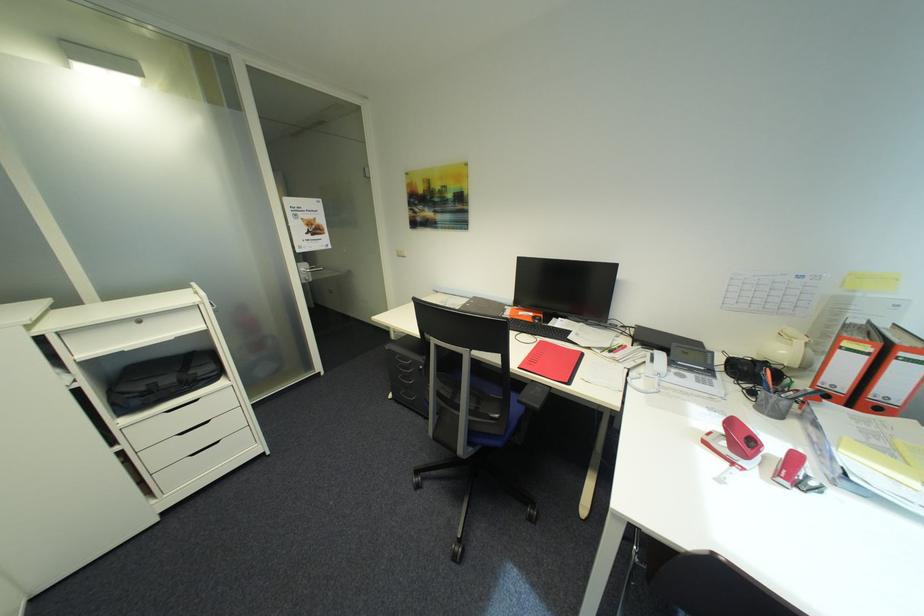
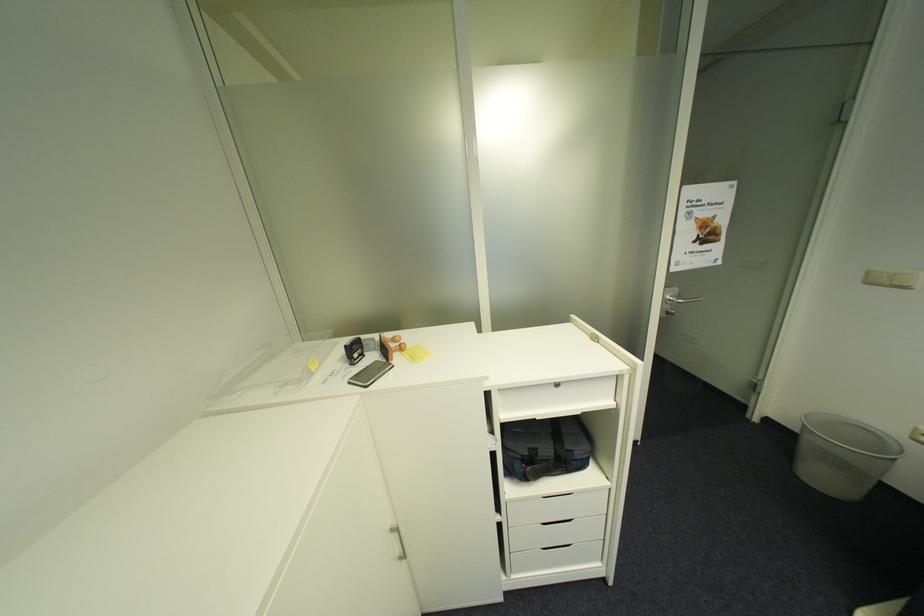
Find the pixel in the second image that matches (x=407, y=257) in the first image.

(876, 284)